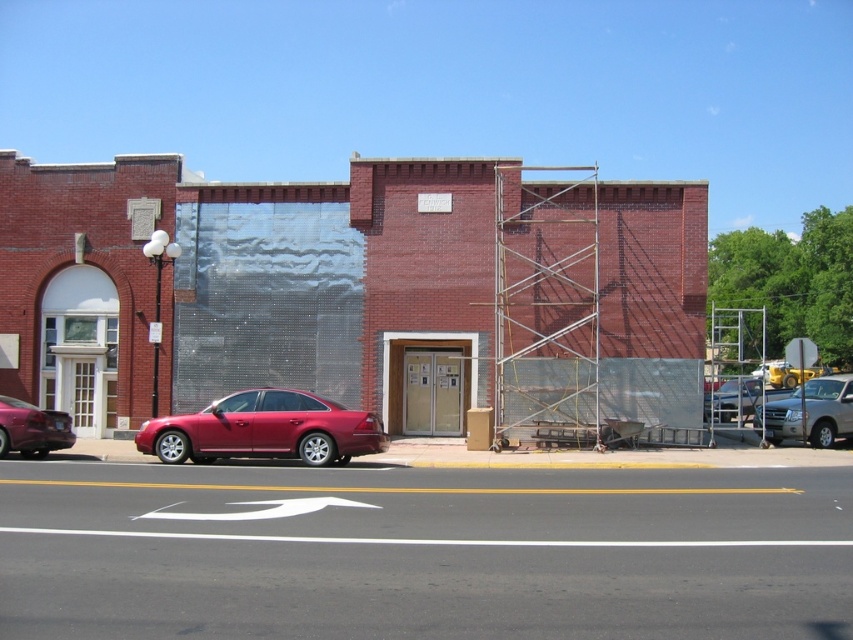
You are standing in front of the two story brick building under renovation. You see two points marked on the facade. The first point is at coordinate point (508, 308) and the second is at point (206, 460). Which point is closer to you?

Point (508, 308) is further to the viewer than point (206, 460), so the second point is closer to you.

You are a construction worker standing at the corner of the street. You need to place a new sign exactly at the center of the brick building at center. According to the coordinates provided, where should you place the sign?

The center of the brick building at center should be placed at the coordinates point (355, 292).

You are a delivery driver approaching the brick building at center and the matte red sedan at center. Which one is closer to the left side of the road?

The matte red sedan at center is closer to the left side of the road because the brick building at center is positioned to its right.